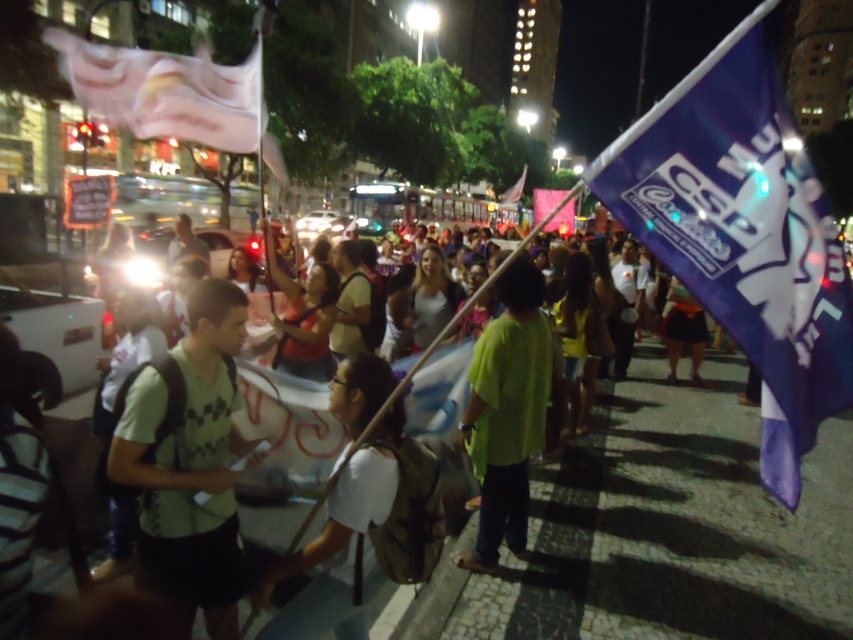
Question: Among these points, which one is farthest from the camera?

Choices:
 (A) (335, 417)
 (B) (213, 524)
 (C) (108, 72)
 (D) (825, 320)

Answer: (A)

Question: Which object is positioned farthest from the white fabric banner at upper left?

Choices:
 (A) white matte shirt at center
 (B) purple fabric flag at right
 (C) green checkered shirt at left
 (D) green matte shirt at center

Answer: (B)

Question: Does green matte shirt at center have a smaller size compared to white fabric banner at upper left?

Choices:
 (A) yes
 (B) no

Answer: (A)

Question: Does purple fabric flag at right appear over white fabric banner at upper left?

Choices:
 (A) yes
 (B) no

Answer: (B)

Question: Which point is farther to the camera?

Choices:
 (A) click(x=480, y=420)
 (B) click(x=213, y=124)
 (C) click(x=360, y=616)
 (D) click(x=235, y=339)

Answer: (A)

Question: Is purple fabric flag at right above white matte shirt at center?

Choices:
 (A) yes
 (B) no

Answer: (A)